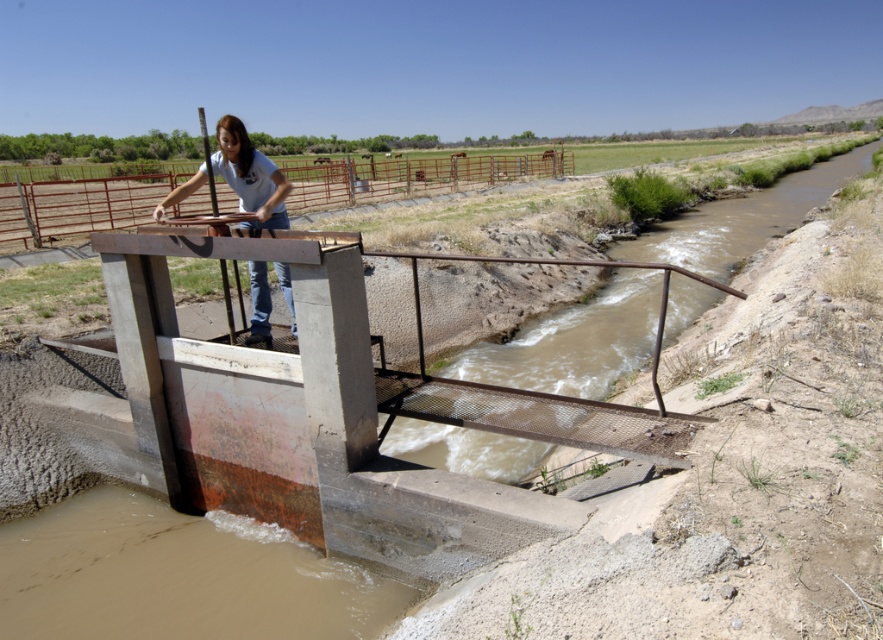
You are a safety inspector evaluating the water control structure. You notice the rusty metal rail at upper center and the matte blue shirt at center. Based on the scene, which object is positioned higher relative to the other?

The rusty metal rail at upper center is above the matte blue shirt at center, so the rusty metal rail at upper center is positioned higher.

What is the position of the rusty metal rail at upper center relative to the matte blue shirt at center?

The rusty metal rail at upper center is to the left of the matte blue shirt at center.

You are a drone operator tasked with capturing aerial footage of the water control structure. You need to ensure that both the point at coordinates point [597,387] and the point at coordinates point [541,172] are in focus. Which point should you focus on first to ensure both are sharp in the photo?

You should focus on point [541,172] first because it is farther from the camera than point [597,387]. By focusing on the farther point, the closer point will also be within the depth of field, ensuring both are sharp.